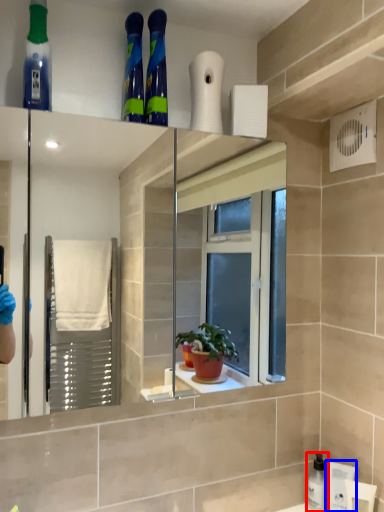
Question: Which of the following is the closest to the observer, cleaning product (highlighted by a red box) or toiletry (highlighted by a blue box)?

Choices:
 (A) cleaning product
 (B) toiletry

Answer: (B)